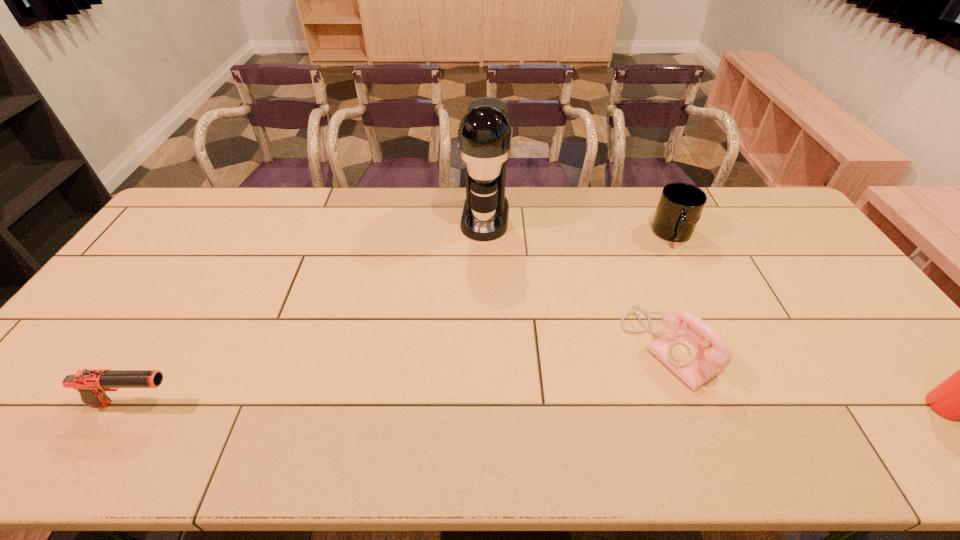
The image size is (960, 540). Identify the location of vacant space on the desktop that is between the leftmost object and the rightmost object and is positioned place cup under the spout of the tallest object. (458, 404).

Where is `free spot on the desktop that is between the gun and the rightmost object and is positioned on the dial of the telephone`? Image resolution: width=960 pixels, height=540 pixels. free spot on the desktop that is between the gun and the rightmost object and is positioned on the dial of the telephone is located at coordinates (580, 405).

Identify the location of free spot on the desktop that is between the gun and the can and is positioned with the handle on the side of the mug. The image size is (960, 540). (608, 406).